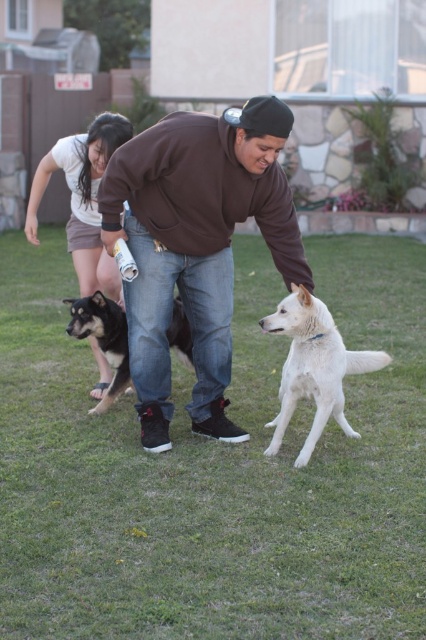
You are a drone operator trying to capture a photo of the black fur dog at center and the green grass at center. Which object should you focus on first if you want to ensure both are in focus?

The green grass at center is below black fur dog at center, so you should focus on the black fur dog at center first to ensure both are in focus.

You are trying to decide whether to place a small table between the brown cotton sweatshirt at center and the black fur dog at center. Based on their heights, will the table be visible from above?

The brown cotton sweatshirt at center is much taller than the black fur dog at center, so the table placed between them might be partially or fully obscured by the sweatshirt depending on its height. However, since the question is about visibility from above, the table would be visible as height differences affect vertical obstruction but not top visibility.